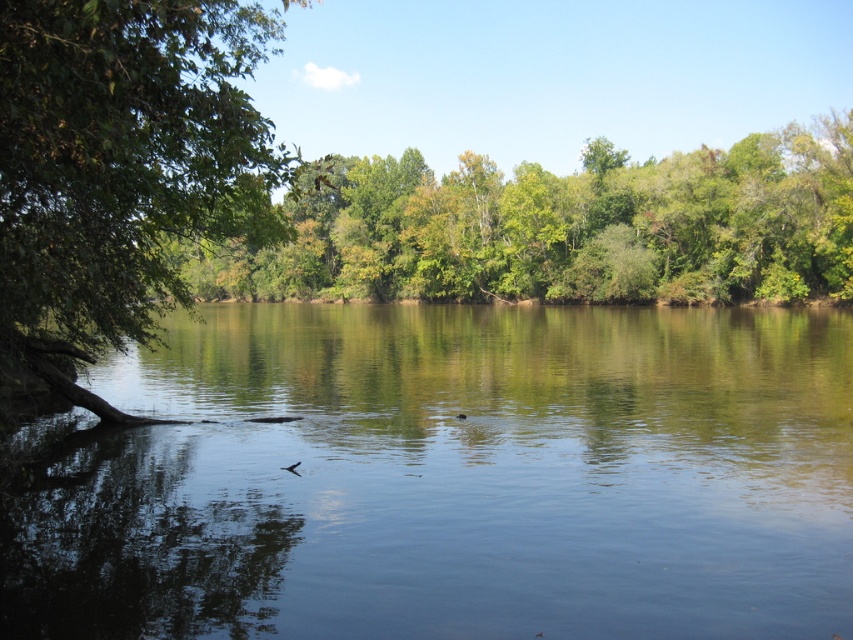
Question: Based on their relative distances, which object is farther from the green leafy trees at center?

Choices:
 (A) clear water at center
 (B) green leafy tree at left

Answer: (B)

Question: Estimate the real-world distances between objects in this image. Which object is closer to the clear water at center?

Choices:
 (A) green leafy trees at center
 (B) green leafy tree at left

Answer: (B)

Question: Among these objects, which one is nearest to the camera?

Choices:
 (A) green leafy tree at left
 (B) clear water at center
 (C) green leafy trees at center

Answer: (A)

Question: In this image, where is clear water at center located relative to green leafy trees at center?

Choices:
 (A) left
 (B) right

Answer: (B)

Question: Is green leafy trees at center smaller than green leafy tree at left?

Choices:
 (A) yes
 (B) no

Answer: (B)

Question: Can you confirm if clear water at center is positioned to the right of green leafy tree at left?

Choices:
 (A) no
 (B) yes

Answer: (B)